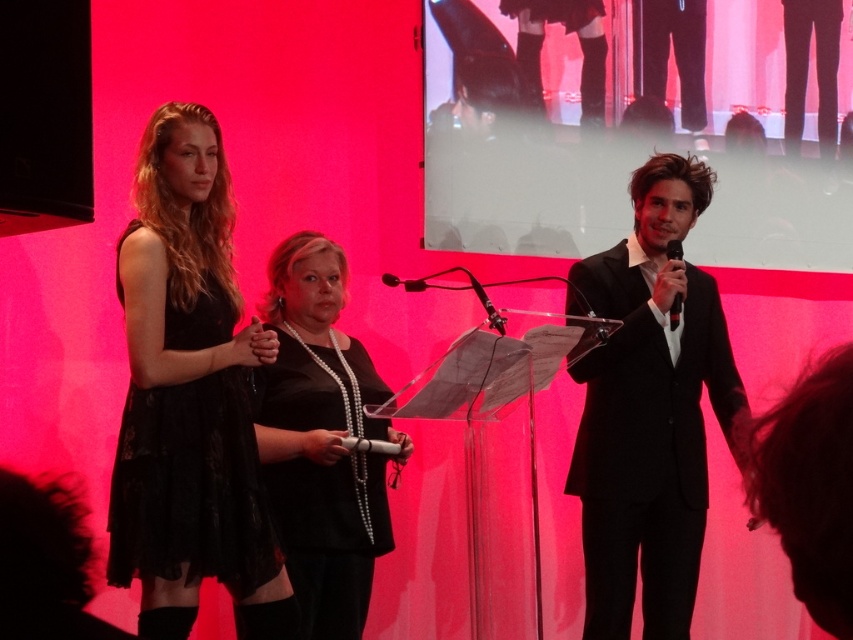
Based on the photo, you are a photographer at the event and want to capture a closeup of the lace black dress at left. Which coordinate should you focus on?

You should focus on point (190,486) to capture the lace black dress at left.

Based on the photo, you are a stagehand preparing to adjust the microphones for the speakers. You need to ensure that the black plastic microphone at right and the black plastic microphone at center are positioned correctly. According to the current setup, which microphone is placed lower on the stage?

The black plastic microphone at right is located below the black plastic microphone at center, so the black plastic microphone at right is placed lower on the stage.

What object is located at the coordinates point (190, 486)?

The lace black dress at left is located at point (190, 486).